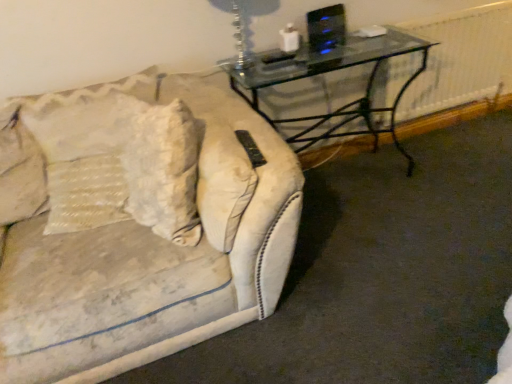
Consider the image. Measure the distance between point [27,188] and camera.

They are 5.65 feet apart.

Describe the element at coordinates (240, 33) in the screenshot. The width and height of the screenshot is (512, 384). I see `clear glass table lamp at upper center` at that location.

Identify the location of white textured pillow at left. Image resolution: width=512 pixels, height=384 pixels. (20, 170).

Which of these two, white textured pillow at left or clear glass table lamp at upper center, is wider?

white textured pillow at left.

Do you think white textured pillow at left is within clear glass table lamp at upper center, or outside of it?

white textured pillow at left is located beyond the bounds of clear glass table lamp at upper center.

What's the angular difference between white textured pillow at left and clear glass table lamp at upper center's facing directions?

4.4 degrees.

From a real-world perspective, is white textured radiator at right above or below clear glass table lamp at upper center?

Clearly, from a real-world perspective, white textured radiator at right is below clear glass table lamp at upper center.

Is white textured radiator at right situated inside clear glass table lamp at upper center or outside?

white textured radiator at right cannot be found inside clear glass table lamp at upper center.

Is point (511, 11) closer or farther from the camera than point (233, 10)?

Point (511, 11).

From the image's perspective, does white textured radiator at right appear higher than clear glass table lamp at upper center?

Indeed, from the image's perspective, white textured radiator at right is shown above clear glass table lamp at upper center.

Considering the sizes of objects white textured radiator at right and white textured pillow at left in the image provided, who is wider, white textured radiator at right or white textured pillow at left?

Wider between the two is white textured pillow at left.

Locate an element on the screen. This screenshot has height=384, width=512. radiator behind the white textured pillow at left is located at coordinates (461, 59).

Is white textured radiator at right oriented away from white textured pillow at left?

No.

Is clear glass table lamp at upper center oriented away from white textured radiator at right?

No, clear glass table lamp at upper center is not facing away from white textured radiator at right.

Considering the relative sizes of clear glass table lamp at upper center and white textured radiator at right in the image provided, is clear glass table lamp at upper center bigger than white textured radiator at right?

Incorrect, clear glass table lamp at upper center is not larger than white textured radiator at right.

Would you say transparent glass table at upper right is outside white textured pillow at left?

Indeed, transparent glass table at upper right is completely outside white textured pillow at left.

Considering the relative sizes of transparent glass table at upper right and white textured pillow at left in the image provided, is transparent glass table at upper right thinner than white textured pillow at left?

No, transparent glass table at upper right is not thinner than white textured pillow at left.

Is transparent glass table at upper right looking in the opposite direction of white textured pillow at left?

No, white textured pillow at left is not at the back of transparent glass table at upper right.

The image size is (512, 384). Identify the location of pillow on the left side of transparent glass table at upper right. (20, 170).

From the image's perspective, is white textured radiator at right on transparent glass table at upper right?

Yes, from the image's perspective, white textured radiator at right is over transparent glass table at upper right.

Image resolution: width=512 pixels, height=384 pixels. In order to click on table on the left of white textured radiator at right in this screenshot , I will do `click(332, 71)`.

Can you tell me how much white textured radiator at right and transparent glass table at upper right differ in facing direction?

There is a 1.23-degree angle between the facing directions of white textured radiator at right and transparent glass table at upper right.

Measure the distance from white textured radiator at right to transparent glass table at upper right.

white textured radiator at right is 13.69 inches from transparent glass table at upper right.

Which is more to the right, clear glass table lamp at upper center or transparent glass table at upper right?

→ From the viewer's perspective, transparent glass table at upper right appears more on the right side.

Considering the positions of objects clear glass table lamp at upper center and transparent glass table at upper right in the image provided, who is behind, clear glass table lamp at upper center or transparent glass table at upper right?

Positioned behind is transparent glass table at upper right.

The width and height of the screenshot is (512, 384). In order to click on table lamp that is above the transparent glass table at upper right (from the image's perspective) in this screenshot , I will do `click(240, 33)`.

Does point (234, 6) appear closer or farther from the camera than point (402, 44)?

Point (234, 6) appears to be closer to the viewer than point (402, 44).

Find the location of a particular element. The image size is (512, 384). pillow located in front of the clear glass table lamp at upper center is located at coordinates (20, 170).

Where is `table lamp below the white textured radiator at right (from the image's perspective)`? The width and height of the screenshot is (512, 384). table lamp below the white textured radiator at right (from the image's perspective) is located at coordinates [240, 33].

Estimate the real-world distances between objects in this image. Which object is closer to transparent glass table at upper right, white textured pillow at left or clear glass table lamp at upper center?

The object closer to transparent glass table at upper right is clear glass table lamp at upper center.

Which object lies further to the anchor point clear glass table lamp at upper center, white textured radiator at right or transparent glass table at upper right?

The object further to clear glass table lamp at upper center is white textured radiator at right.

From the image, which object appears to be farther from transparent glass table at upper right, clear glass table lamp at upper center or white textured radiator at right?

Among the two, clear glass table lamp at upper center is located further to transparent glass table at upper right.

Based on their spatial positions, is clear glass table lamp at upper center or white textured radiator at right further from white textured pillow at left?

Among the two, white textured radiator at right is located further to white textured pillow at left.

Based on their spatial positions, is white textured radiator at right or white textured pillow at left closer to clear glass table lamp at upper center?

The object closer to clear glass table lamp at upper center is white textured pillow at left.

Estimate the real-world distances between objects in this image. Which object is further from clear glass table lamp at upper center, transparent glass table at upper right or white textured radiator at right?

Among the two, white textured radiator at right is located further to clear glass table lamp at upper center.

Estimate the real-world distances between objects in this image. Which object is closer to white textured pillow at left, white textured radiator at right or clear glass table lamp at upper center?

clear glass table lamp at upper center lies closer to white textured pillow at left than the other object.

Looking at the image, which one is located closer to white textured pillow at left, clear glass table lamp at upper center or transparent glass table at upper right?

clear glass table lamp at upper center is positioned closer to the anchor white textured pillow at left.

At what (x,y) coordinates should I click in order to perform the action: click on table lamp between white textured pillow at left and transparent glass table at upper right in the horizontal direction. Please return your answer as a coordinate pair (x, y). Looking at the image, I should click on (240, 33).

You are a GUI agent. You are given a task and a screenshot of the screen. Output one action in this format:
    pyautogui.click(x=<x>, y=<y>)
    Task: Click on the table located between clear glass table lamp at upper center and white textured radiator at right in the left-right direction
    Image resolution: width=512 pixels, height=384 pixels.
    Given the screenshot: What is the action you would take?
    pyautogui.click(x=332, y=71)

Find the location of `table located between white textured pillow at left and white textured radiator at right in the left-right direction`. table located between white textured pillow at left and white textured radiator at right in the left-right direction is located at coordinates (332, 71).

Image resolution: width=512 pixels, height=384 pixels. I want to click on table lamp between white textured pillow at left and white textured radiator at right from left to right, so click(240, 33).